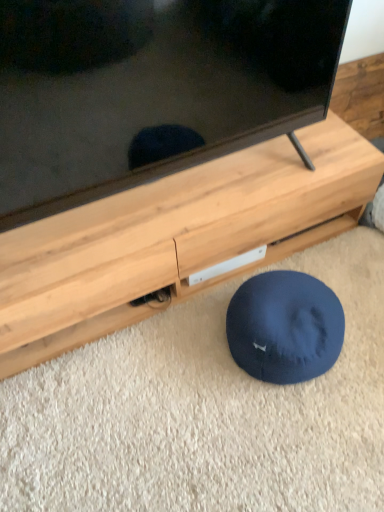
Locate an element on the screen. unoccupied region to the right of navy blue fabric dog bed at lower center is located at coordinates (361, 320).